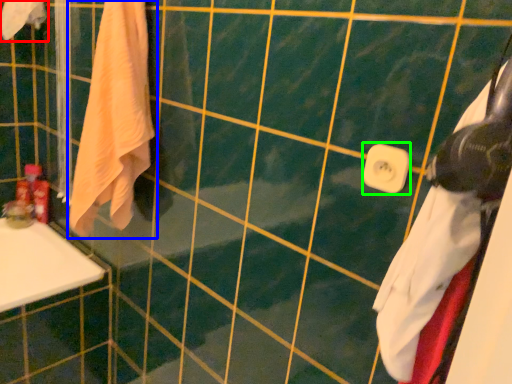
Question: Which object is positioned farthest from towel (highlighted by a red box)? Select from towel (highlighted by a blue box) and towel bar (highlighted by a green box).

Choices:
 (A) towel
 (B) towel bar

Answer: (B)